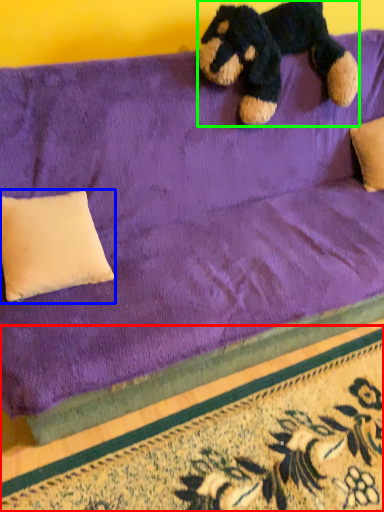
Question: Which object is positioned closest to doormat (highlighted by a red box)? Select from pillow (highlighted by a blue box) and teddy bear (highlighted by a green box).

Choices:
 (A) pillow
 (B) teddy bear

Answer: (A)